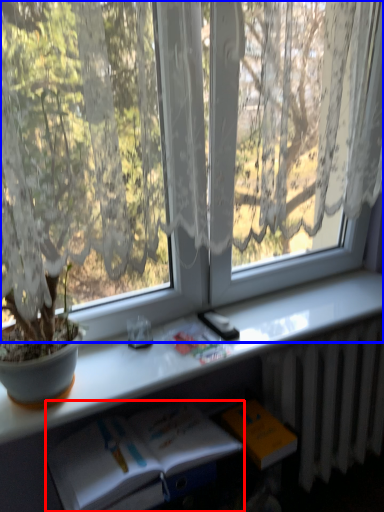
Question: Which object is further to the camera taking this photo, book (highlighted by a red box) or window (highlighted by a blue box)?

Choices:
 (A) book
 (B) window

Answer: (A)